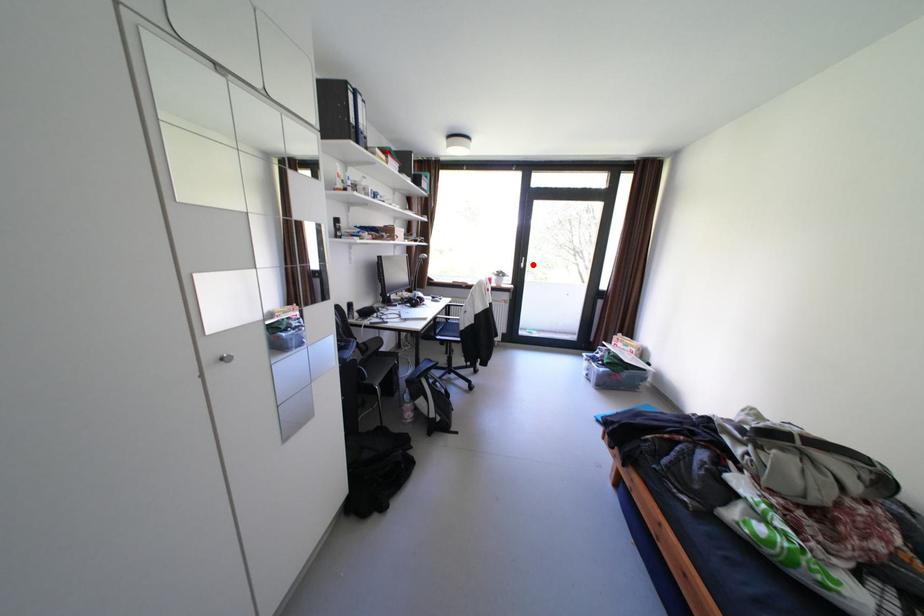
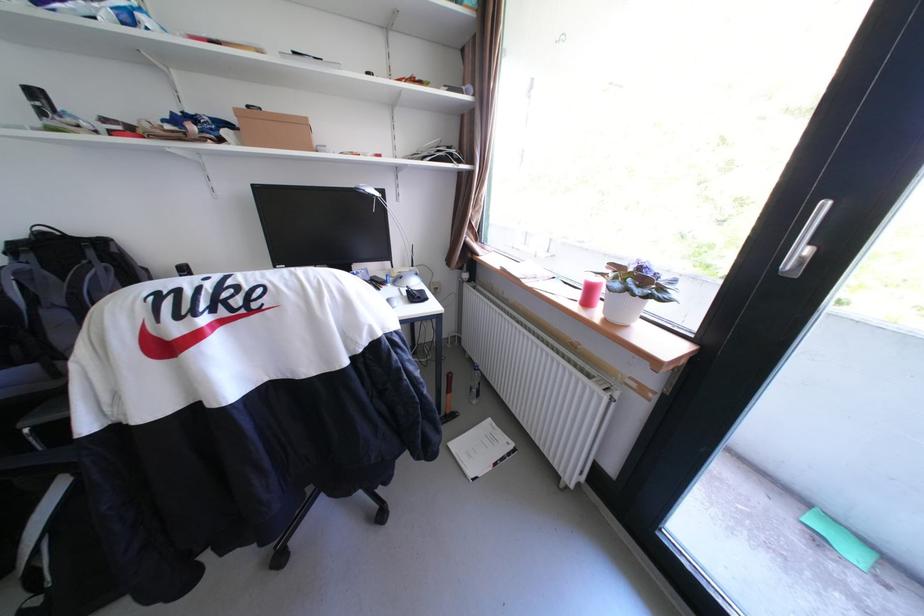
Where in the second image is the point corresponding to the highlighted location from the first image?

(813, 253)